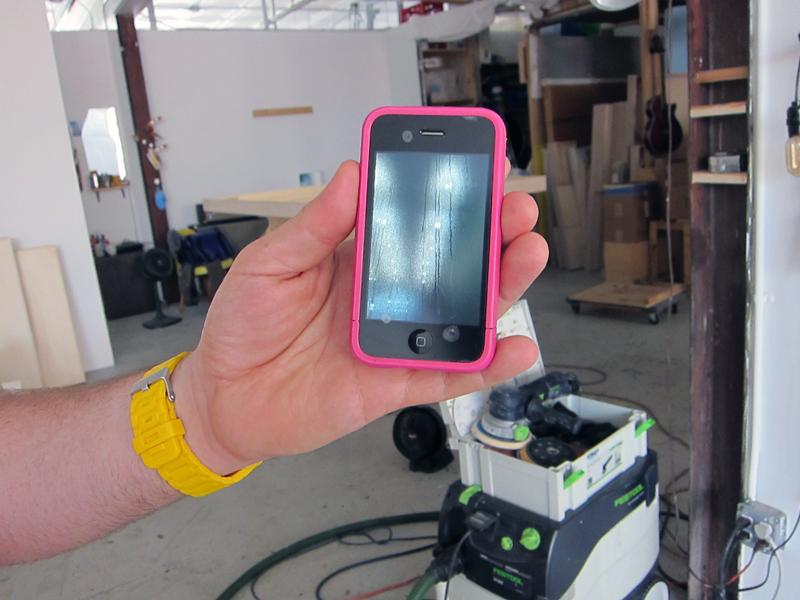
In order to click on green knob in this screenshot , I will do `click(530, 545)`.